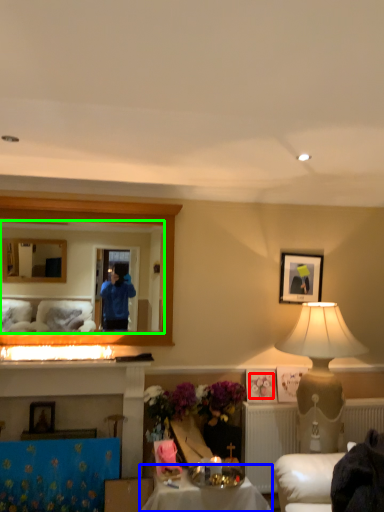
Question: Which is farther away from flower (highlighted by a red box)? table (highlighted by a blue box) or mirror (highlighted by a green box)?

Choices:
 (A) table
 (B) mirror

Answer: (B)